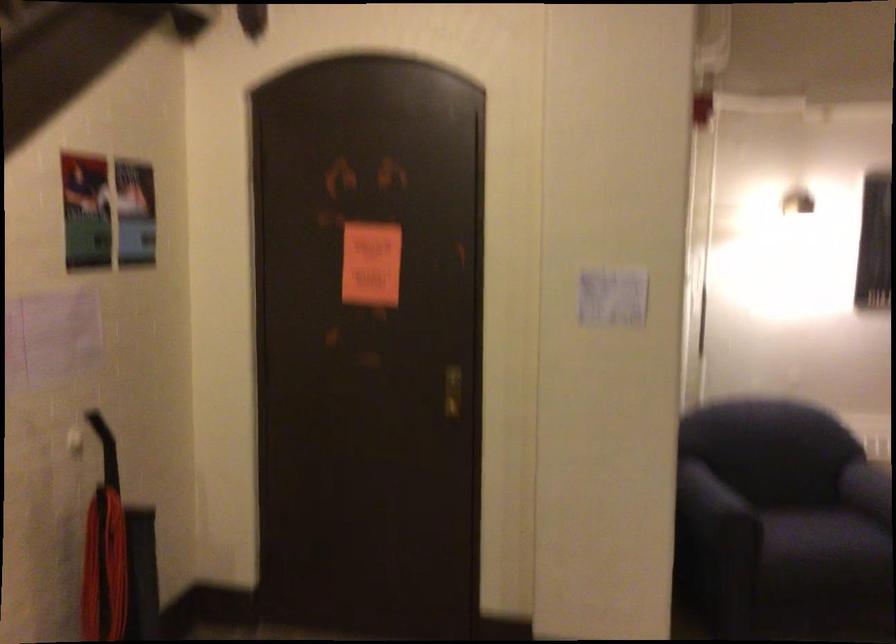
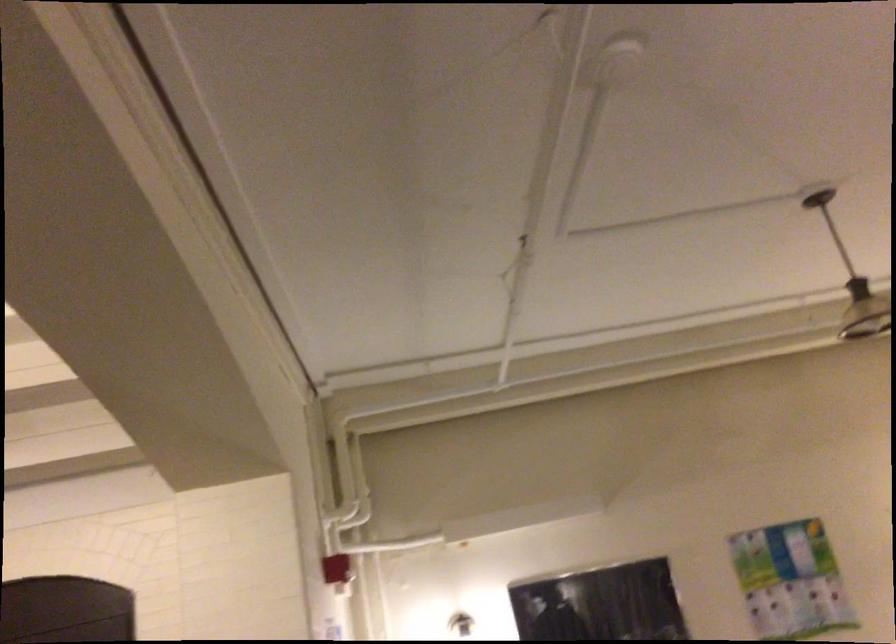
Locate, in the second image, the point that corresponds to the point at 711,111 in the first image.

(337, 569)